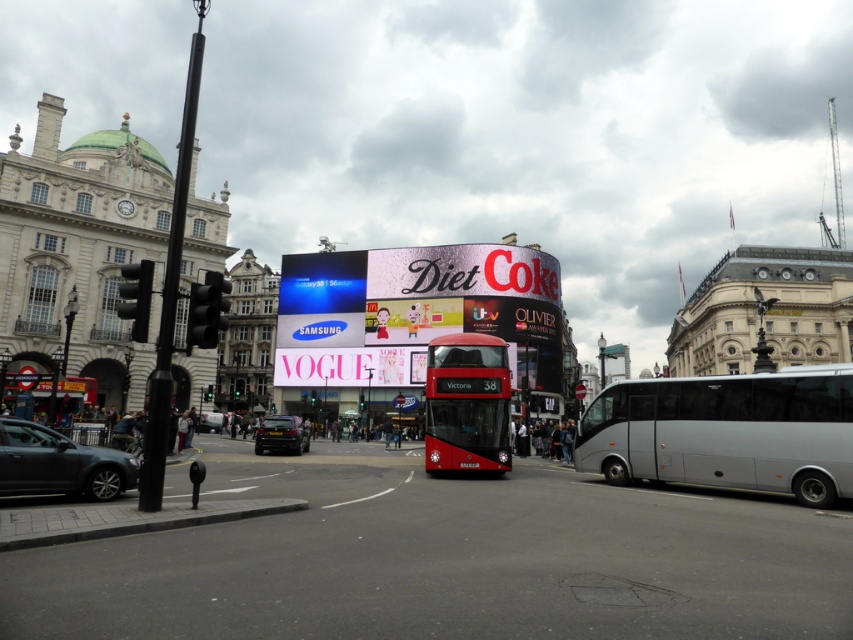
You are a pedestrian standing at the crosswalk near the silver metallic bus at right and the metallic silver car at lower left. Which vehicle is blocking your view of the other?

The silver metallic bus at right is positioned over the metallic silver car at lower left, so it is blocking the view of the car.

You are standing at the intersection in the image and want to walk towards the point marked as point (0, 472). Which direction should you go relative to the point marked as point (271, 429)?

Point (0, 472) is closer to the viewer than point (271, 429), so you should walk towards the direction of point (0, 472) which is closer to you compared to point (271, 429).

You are a pedestrian standing at the crosswalk and see both the silver metallic bus at right and the metallic silver car at lower left. Which vehicle is closer to you?

The silver metallic bus at right is closer to you because it is in front of the metallic silver car at lower left.